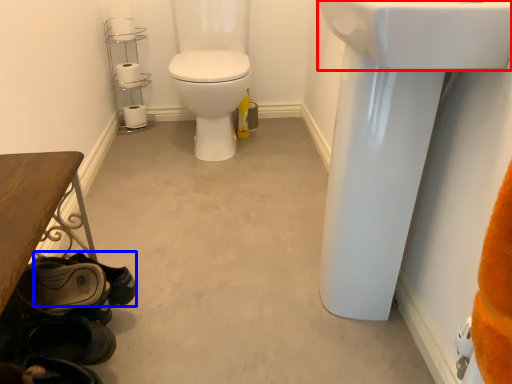
Question: Which of the following is the closest to the observer, sink (highlighted by a red box) or shoe (highlighted by a blue box)?

Choices:
 (A) sink
 (B) shoe

Answer: (A)